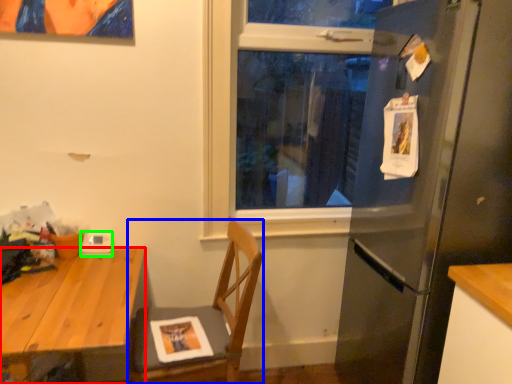
Question: Based on their relative distances, which object is nearer to desk (highlighted by a red box)? Choose from chair (highlighted by a blue box) and appliance (highlighted by a green box).

Choices:
 (A) chair
 (B) appliance

Answer: (B)